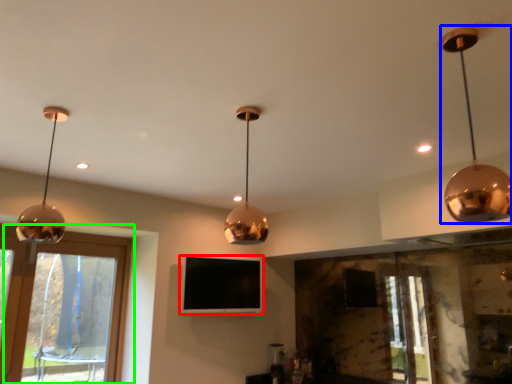
Question: Considering the real-world distances, which object is closest to television (highlighted by a red box)? lamp (highlighted by a blue box) or window (highlighted by a green box).

Choices:
 (A) lamp
 (B) window

Answer: (B)